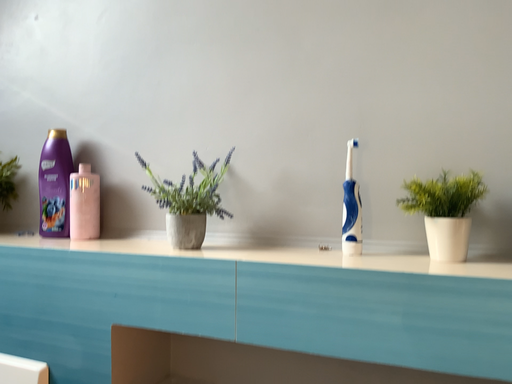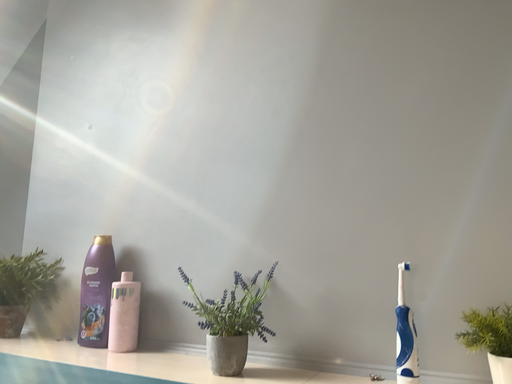
Question: How did the camera likely rotate when shooting the video?

Choices:
 (A) rotated upward
 (B) rotated downward

Answer: (A)